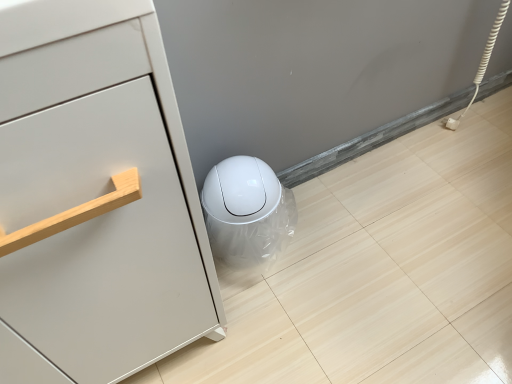
Question: Considering the positions of matte white cabinet at left and white glossy trash can at lower center in the image, is matte white cabinet at left taller or shorter than white glossy trash can at lower center?

Choices:
 (A) short
 (B) tall

Answer: (B)

Question: Looking at their shapes, would you say matte white cabinet at left is wider or thinner than white glossy trash can at lower center?

Choices:
 (A) wide
 (B) thin

Answer: (A)

Question: In the image, is matte white cabinet at left positioned in front of or behind white glossy trash can at lower center?

Choices:
 (A) front
 (B) behind

Answer: (A)

Question: Is white glossy trash can at lower center to the left or to the right of matte white cabinet at left in the image?

Choices:
 (A) left
 (B) right

Answer: (B)

Question: From a real-world perspective, is white glossy trash can at lower center physically located above or below matte white cabinet at left?

Choices:
 (A) below
 (B) above

Answer: (A)

Question: Considering their positions, is white glossy trash can at lower center located in front of or behind matte white cabinet at left?

Choices:
 (A) front
 (B) behind

Answer: (B)

Question: Choose the correct answer: Is white glossy trash can at lower center inside matte white cabinet at left or outside it?

Choices:
 (A) outside
 (B) inside

Answer: (A)